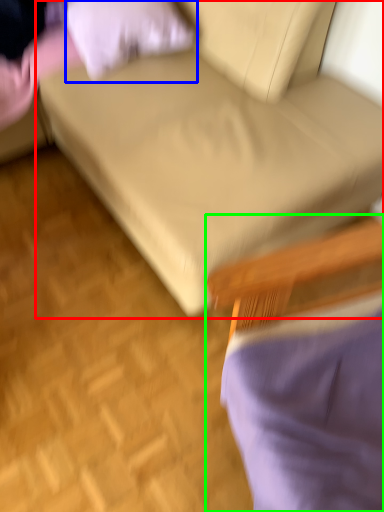
Question: Estimate the real-world distances between objects in this image. Which object is farther from studio couch (highlighted by a red box), pillow (highlighted by a blue box) or chair (highlighted by a green box)?

Choices:
 (A) pillow
 (B) chair

Answer: (B)